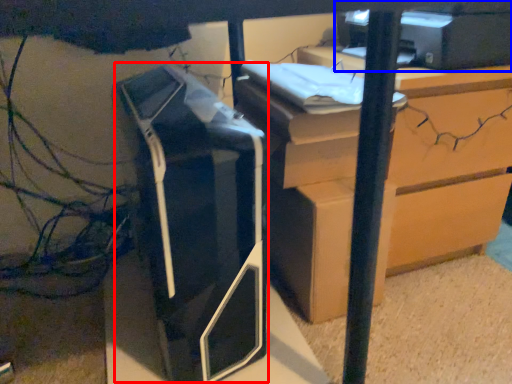
Question: Which object is further to the camera taking this photo, printer (highlighted by a red box) or printer (highlighted by a blue box)?

Choices:
 (A) printer
 (B) printer

Answer: (B)